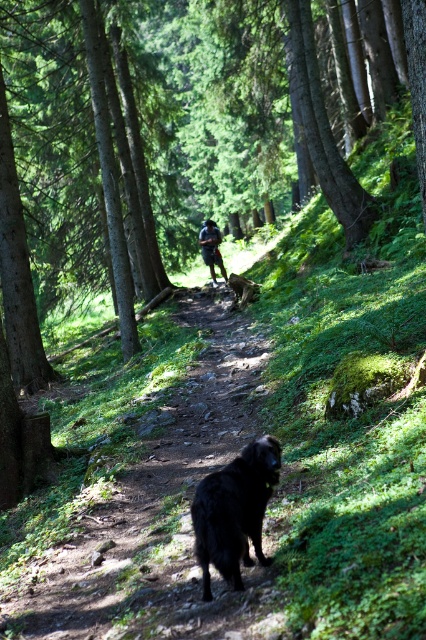
Question: Which object is positioned farthest from the dark blue fabric shirt at center?

Choices:
 (A) black furry dog at center
 (B) black fur dog at center

Answer: (A)

Question: Which point is closer to the camera?

Choices:
 (A) black fur dog at center
 (B) dark blue fabric shirt at center

Answer: (A)

Question: Is black furry dog at center in front of dark blue fabric shirt at center?

Choices:
 (A) yes
 (B) no

Answer: (A)

Question: Does black fur dog at center appear over black furry dog at center?

Choices:
 (A) no
 (B) yes

Answer: (B)

Question: Is black furry dog at center to the right of dark blue fabric shirt at center from the viewer's perspective?

Choices:
 (A) yes
 (B) no

Answer: (A)

Question: Which is nearer to the dark blue fabric shirt at center?

Choices:
 (A) black fur dog at center
 (B) black furry dog at center

Answer: (A)